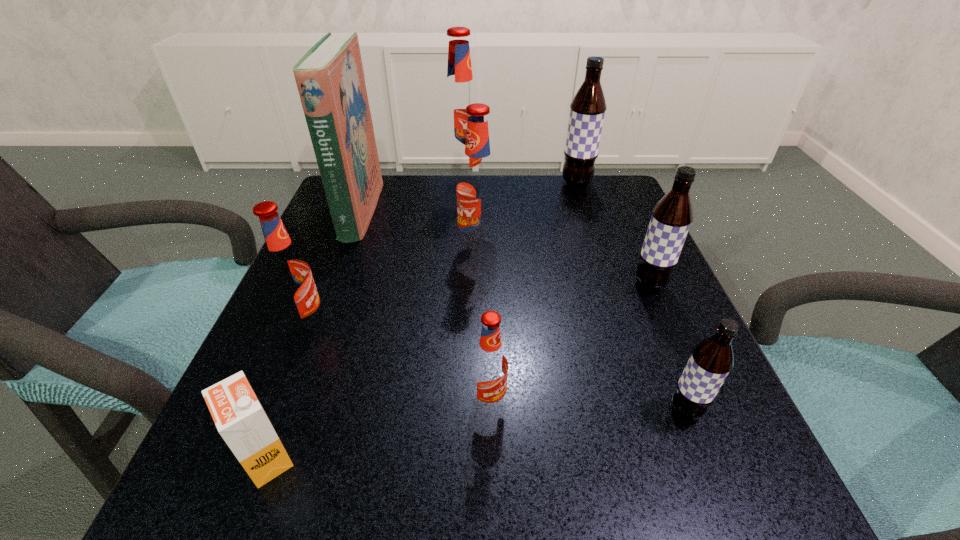
Locate which brown root beer is the closest to the fifth nearest object. Please provide its 2D coordinates. Your answer should be formatted as a tuple, i.e. [(x, y)], where the tuple contains the x and y coordinates of a point satisfying the conditions above.

[(711, 360)]

Identify the location of free space in the image that satisfies the following two spatial constraints: 1. on the front side of the second smallest red root beer; 2. on the left side of the nearest brown root beer. The image size is (960, 540). (273, 410).

Image resolution: width=960 pixels, height=540 pixels. I want to click on vacant point that satisfies the following two spatial constraints: 1. on the cover of the hardback book; 2. on the back side of the smallest red root beer, so click(x=289, y=402).

Identify the location of vacant area that satisfies the following two spatial constraints: 1. on the cover of the nearest brown root beer; 2. on the left side of the hardback book. (286, 410).

This screenshot has width=960, height=540. I want to click on blank space that satisfies the following two spatial constraints: 1. on the back side of the nearest object; 2. on the left side of the third nearest red root beer, so click(x=346, y=249).

Where is `vacant space that satisfies the following two spatial constraints: 1. on the cover of the smallest brown root beer; 2. on the left side of the hardback book`? This screenshot has height=540, width=960. vacant space that satisfies the following two spatial constraints: 1. on the cover of the smallest brown root beer; 2. on the left side of the hardback book is located at coordinates (286, 410).